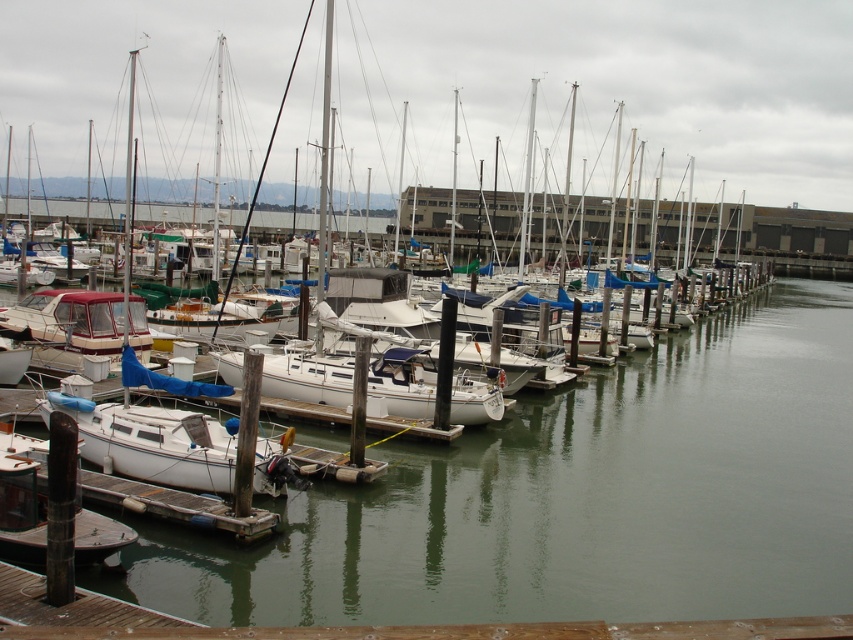
Question: Can you confirm if clear water at center is smaller than white matte sailboat at lower left?

Choices:
 (A) yes
 (B) no

Answer: (A)

Question: Which of the following is the closest to the observer?

Choices:
 (A) clear water at center
 (B) white matte sailboat at lower left

Answer: (A)

Question: Is clear water at center to the right of white matte sailboat at lower left from the viewer's perspective?

Choices:
 (A) no
 (B) yes

Answer: (B)

Question: Is clear water at center thinner than white matte sailboat at lower left?

Choices:
 (A) yes
 (B) no

Answer: (A)